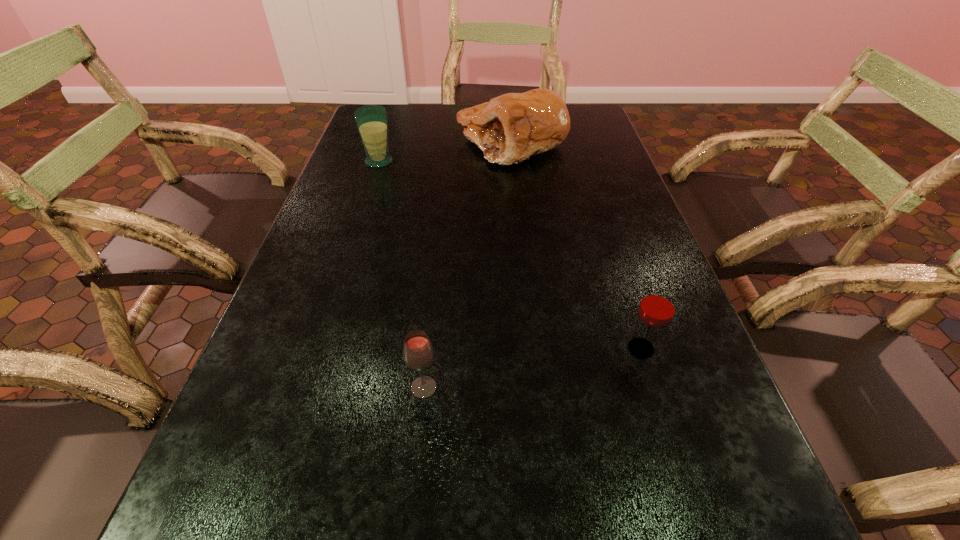
Locate an element on the screen. This screenshot has width=960, height=540. unoccupied position between the leftmost object and the nearest object is located at coordinates (401, 275).

Identify which object is located as the nearest to the bread. Please provide its 2D coordinates. Your answer should be formatted as a tuple, i.e. [(x, y)], where the tuple contains the x and y coordinates of a point satisfying the conditions above.

[(372, 120)]

Identify the location of the second closest object to the nearest object. This screenshot has width=960, height=540. (510, 128).

Identify which glass drink container is the second nearest to the nearest object. Please provide its 2D coordinates. Your answer should be formatted as a tuple, i.e. [(x, y)], where the tuple contains the x and y coordinates of a point satisfying the conditions above.

[(372, 120)]

Locate an element on the screen. This screenshot has height=540, width=960. glass drink container that stands as the closest to the second glass drink container from left to right is located at coordinates (657, 307).

This screenshot has width=960, height=540. I want to click on vacant area in the image that satisfies the following two spatial constraints: 1. on the filling side of the bread; 2. on the front side of the leftmost glass drink container, so click(514, 161).

You are a GUI agent. You are given a task and a screenshot of the screen. Output one action in this format:
    pyautogui.click(x=<x>, y=<y>)
    Task: Click on the free space that satisfies the following two spatial constraints: 1. on the front side of the leftmost object; 2. on the left side of the nearest glass drink container
    
    Given the screenshot: What is the action you would take?
    pyautogui.click(x=305, y=388)

You are a GUI agent. You are given a task and a screenshot of the screen. Output one action in this format:
    pyautogui.click(x=<x>, y=<y>)
    Task: Click on the blank area in the image that satisfies the following two spatial constraints: 1. on the back side of the second nearest glass drink container; 2. on the right side of the nearest object
    
    Given the screenshot: What is the action you would take?
    pyautogui.click(x=428, y=349)